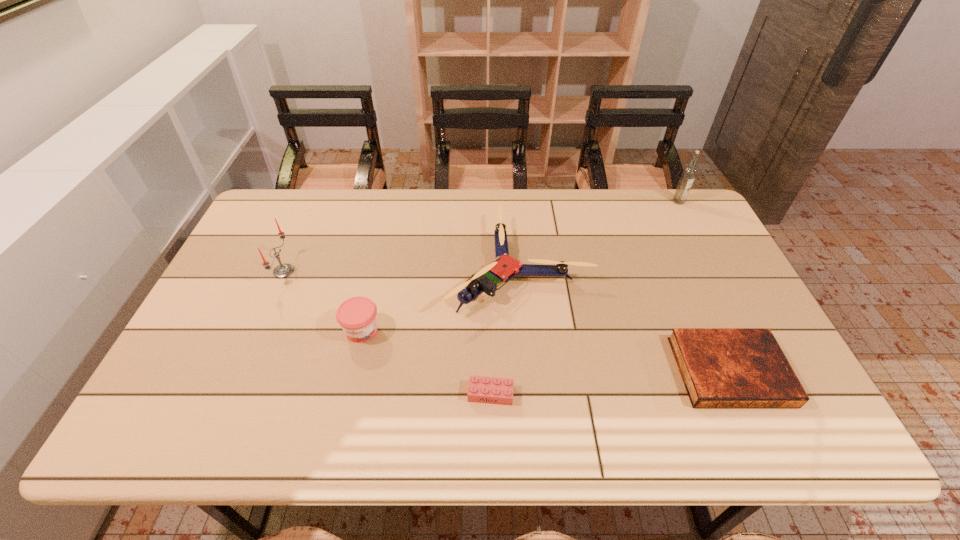
Locate an element on the screen. This screenshot has height=540, width=960. vacant area that lies between the Bible and the drone is located at coordinates (624, 319).

Where is `vacant point located between the farthest object and the Bible`? The width and height of the screenshot is (960, 540). vacant point located between the farthest object and the Bible is located at coordinates (x=704, y=286).

Image resolution: width=960 pixels, height=540 pixels. Identify the location of free space between the Bible and the Lego. (611, 382).

I want to click on unoccupied position between the candle and the jam, so click(323, 301).

The image size is (960, 540). Find the location of `unoccupied area between the drone and the tallest object`. unoccupied area between the drone and the tallest object is located at coordinates [x=599, y=234].

At what (x,y) coordinates should I click in order to perform the action: click on empty space that is in between the vodka and the second tallest object. Please return your answer as a coordinate pair (x, y). This screenshot has width=960, height=540. Looking at the image, I should click on (481, 237).

In order to click on free area in between the leftmost object and the Bible in this screenshot , I will do `click(507, 321)`.

Identify which object is the fifth nearest to the candle. Please provide its 2D coordinates. Your answer should be formatted as a tuple, i.e. [(x, y)], where the tuple contains the x and y coordinates of a point satisfying the conditions above.

[(688, 175)]

Locate an element on the screen. object that is the closest one to the candle is located at coordinates (357, 316).

Identify the location of vacant point that satisfies the following two spatial constraints: 1. on the front-facing side of the candle; 2. on the left side of the Lego. The width and height of the screenshot is (960, 540). (230, 394).